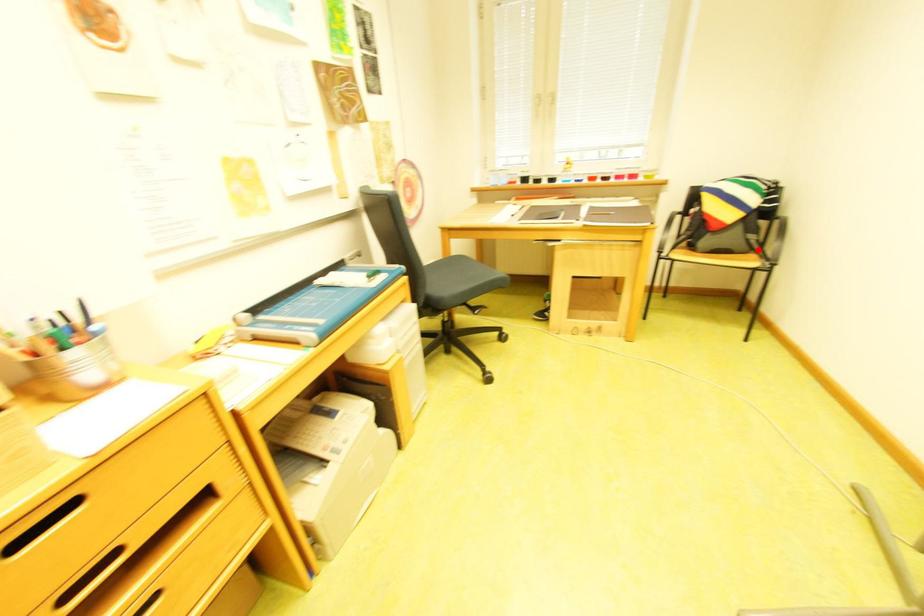
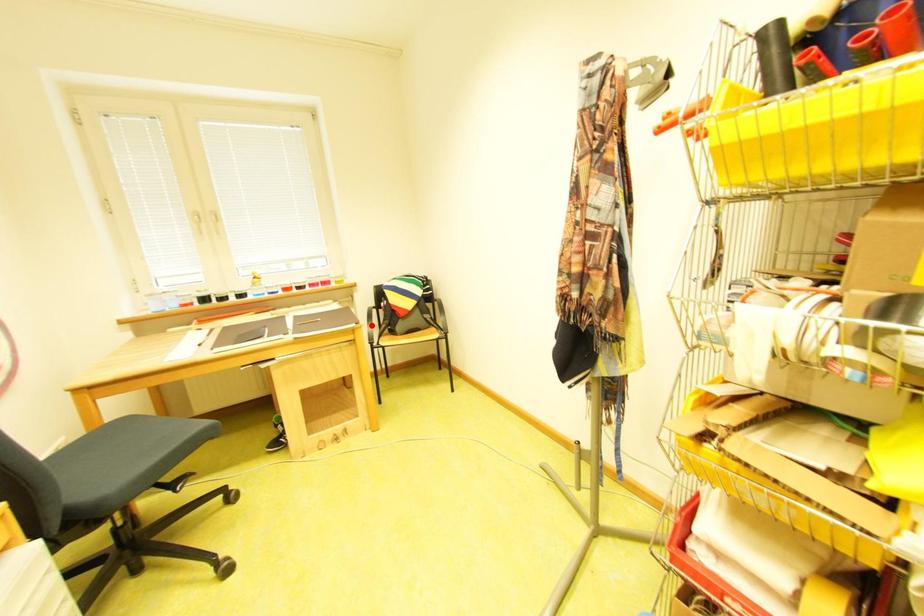
I am providing you with two images of the same scene from different viewpoints. A red point is marked on the first image and another point is marked on the second image. Is the red point in image1 aligned with the point shown in image2?

No